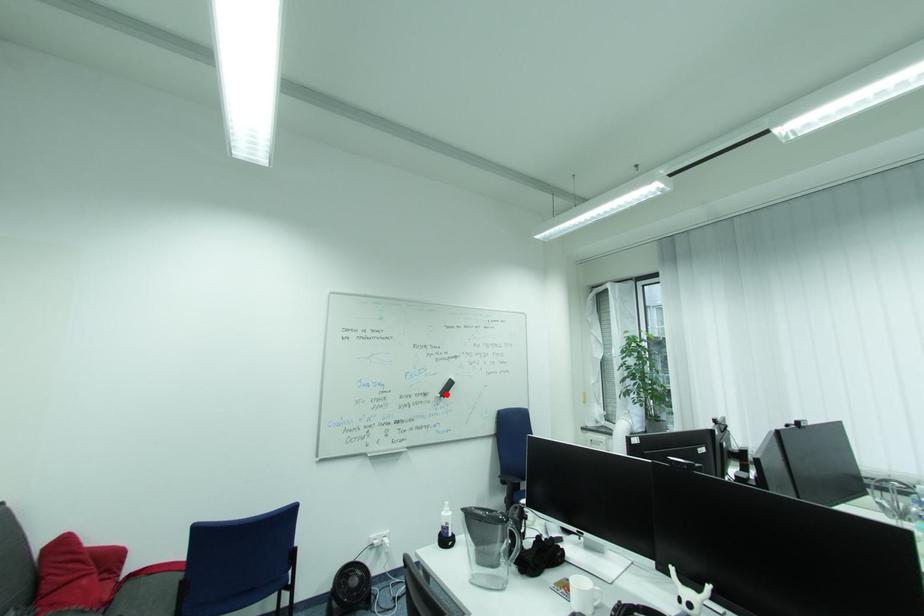
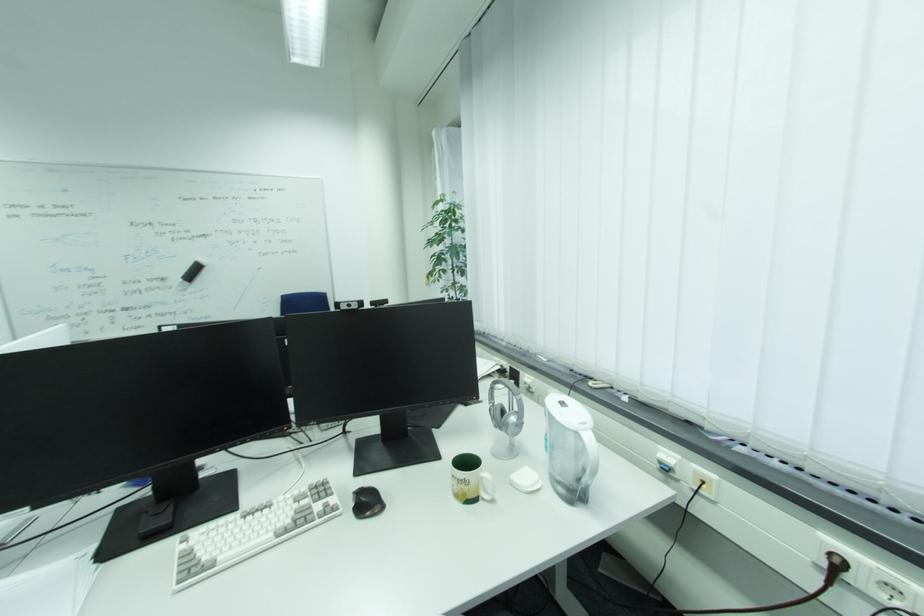
Locate, in the second image, the point that corresponds to the highlighted location in the first image.

(189, 278)